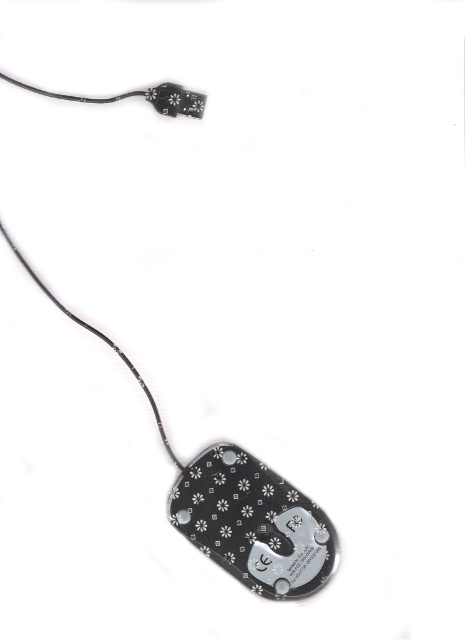
Can you confirm if black glossy mouse at bottom is shorter than black glossy plug at upper center?

No, black glossy mouse at bottom is not shorter than black glossy plug at upper center.

Is black glossy mouse at bottom positioned behind black glossy plug at upper center?

No, black glossy mouse at bottom is in front of black glossy plug at upper center.

Image resolution: width=465 pixels, height=640 pixels. I want to click on black glossy mouse at bottom, so click(x=238, y=504).

Image resolution: width=465 pixels, height=640 pixels. I want to click on black glossy mouse at bottom, so click(x=238, y=504).